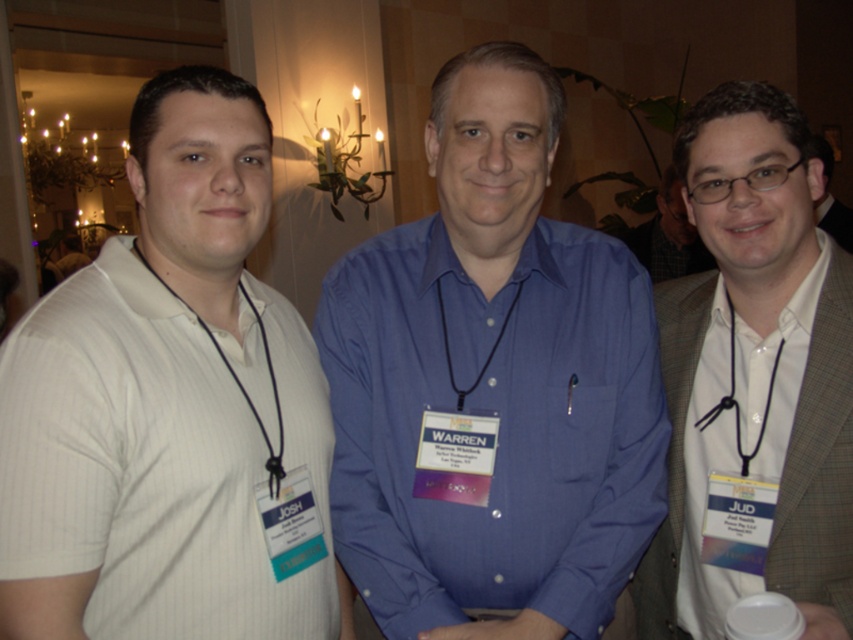
Is point (451, 243) farther from viewer compared to point (730, 310)?

That is False.

Which is below, blue shirt at center or gray checkered suit at right?

Positioned lower is gray checkered suit at right.

At what (x,y) coordinates should I click in order to perform the action: click on blue shirt at center. Please return your answer as a coordinate pair (x, y). Looking at the image, I should click on (492, 385).

Can you confirm if blue shirt at center is positioned to the left of black cord stethoscope at center?

No, blue shirt at center is not to the left of black cord stethoscope at center.

From the picture: Who is more distant from viewer, (440, 444) or (440, 292)?

Point (440, 292)

Who is more forward, (642, 365) or (436, 289)?

Point (642, 365) is in front.

You are a GUI agent. You are given a task and a screenshot of the screen. Output one action in this format:
    pyautogui.click(x=<x>, y=<y>)
    Task: Click on the blue shirt at center
    Image resolution: width=853 pixels, height=640 pixels.
    Given the screenshot: What is the action you would take?
    pyautogui.click(x=492, y=385)

Who is positioned more to the left, blue shirt at center or matte black glasses at center?

blue shirt at center is more to the left.

Can you confirm if blue shirt at center is taller than matte black glasses at center?

Yes, blue shirt at center is taller than matte black glasses at center.

Locate an element on the screen. The height and width of the screenshot is (640, 853). blue shirt at center is located at coordinates (492, 385).

Identify the location of blue shirt at center. (492, 385).